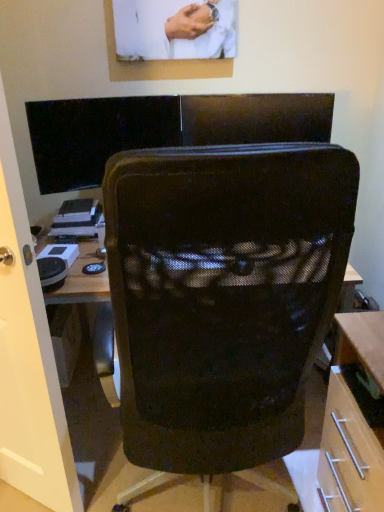
What do you see at coordinates (95, 135) in the screenshot?
I see `black glossy monitor at upper left` at bounding box center [95, 135].

Image resolution: width=384 pixels, height=512 pixels. What are the coordinates of `black glossy monitor at upper left` in the screenshot? It's located at (95, 135).

The height and width of the screenshot is (512, 384). Describe the element at coordinates (28, 357) in the screenshot. I see `transparent glass door at left` at that location.

What do you see at coordinates (223, 295) in the screenshot?
I see `black mesh chair at center` at bounding box center [223, 295].

The width and height of the screenshot is (384, 512). In order to click on black glossy monitor at upper left in this screenshot , I will do `click(95, 135)`.

Is black mesh chair at center at the right side of black glossy monitor at upper left?

Yes.

Are black mesh chair at center and black glossy monitor at upper left far apart?

Yes, black mesh chair at center and black glossy monitor at upper left are quite far apart.

Is black mesh chair at center positioned in front of black glossy monitor at upper left?

Yes, black mesh chair at center is closer to the camera.

Can you confirm if black mesh chair at center is thinner than black glossy monitor at upper left?

No, black mesh chair at center is not thinner than black glossy monitor at upper left.

In the scene shown: Is transparent glass door at left completely or partially outside of black glossy monitor at upper left?

That's correct, transparent glass door at left is outside of black glossy monitor at upper left.

Looking at this image, which object is positioned more to the right, transparent glass door at left or black glossy monitor at upper left?

black glossy monitor at upper left.

From a real-world perspective, which is physically below, transparent glass door at left or black glossy monitor at upper left?

transparent glass door at left, from a real-world perspective.

Relative to black glossy monitor at upper left, is transparent glass door at left in front or behind?

In the image, transparent glass door at left appears in front of black glossy monitor at upper left.

Is black mesh chair at center thinner than transparent glass door at left?

No, black mesh chair at center is not thinner than transparent glass door at left.

Does point (168, 387) appear closer or farther from the camera than point (27, 239)?

Point (168, 387) is positioned closer to the camera compared to point (27, 239).

Is black mesh chair at center facing towards transparent glass door at left?

No, black mesh chair at center does not turn towards transparent glass door at left.

Can you confirm if black mesh chair at center is bigger than transparent glass door at left?

Yes.

Is black glossy monitor at upper left facing away from transparent glass door at left?

No, black glossy monitor at upper left's orientation is not away from transparent glass door at left.

You are a GUI agent. You are given a task and a screenshot of the screen. Output one action in this format:
    pyautogui.click(x=<x>, y=<y>)
    Task: Click on the computer monitor on the right of transparent glass door at left
    This screenshot has width=384, height=512.
    Given the screenshot: What is the action you would take?
    pyautogui.click(x=95, y=135)

Is black glossy monitor at upper left at the right side of transparent glass door at left?

Yes.

From a real-world perspective, is black glossy monitor at upper left over transparent glass door at left?

Correct, in the physical world, black glossy monitor at upper left is higher than transparent glass door at left.

Is black glossy monitor at upper left thinner than black mesh chair at center?

Correct, the width of black glossy monitor at upper left is less than that of black mesh chair at center.

Are black glossy monitor at upper left and black mesh chair at center far apart?

Yes, black glossy monitor at upper left is far from black mesh chair at center.

Is black glossy monitor at upper left positioned with its back to black mesh chair at center?

That's not correct — black glossy monitor at upper left is not looking away from black mesh chair at center.

Where is `computer monitor above the black mesh chair at center (from the image's perspective)`? computer monitor above the black mesh chair at center (from the image's perspective) is located at coordinates (95, 135).

Is transparent glass door at left oriented towards black mesh chair at center?

No, transparent glass door at left is not facing towards black mesh chair at center.

Which point is more forward, (x=39, y=354) or (x=290, y=341)?

The point (x=290, y=341) is more forward.

In terms of width, does transparent glass door at left look wider or thinner when compared to black mesh chair at center?

transparent glass door at left is thinner than black mesh chair at center.

Find the location of a particular element. computer monitor lying behind the black mesh chair at center is located at coordinates (95, 135).

This screenshot has width=384, height=512. In order to click on glass door below the black glossy monitor at upper left (from the image's perspective) in this screenshot , I will do `click(28, 357)`.

Estimate the real-world distances between objects in this image. Which object is closer to black glossy monitor at upper left, black mesh chair at center or transparent glass door at left?

Among the two, transparent glass door at left is located nearer to black glossy monitor at upper left.

Considering their positions, is transparent glass door at left positioned closer to black glossy monitor at upper left than black mesh chair at center?

transparent glass door at left is closer to black glossy monitor at upper left.

Based on their spatial positions, is black glossy monitor at upper left or black mesh chair at center further from transparent glass door at left?

The object further to transparent glass door at left is black glossy monitor at upper left.

Looking at the image, which one is located further to black mesh chair at center, black glossy monitor at upper left or transparent glass door at left?

black glossy monitor at upper left is positioned further to the anchor black mesh chair at center.

Estimate the real-world distances between objects in this image. Which object is further from transparent glass door at left, black mesh chair at center or black glossy monitor at upper left?

Among the two, black glossy monitor at upper left is located further to transparent glass door at left.

Looking at the image, which one is located closer to black mesh chair at center, transparent glass door at left or black glossy monitor at upper left?

The object closer to black mesh chair at center is transparent glass door at left.

Find the location of `glass door between black mesh chair at center and black glossy monitor at upper left in the front-back direction`. glass door between black mesh chair at center and black glossy monitor at upper left in the front-back direction is located at coordinates (28, 357).